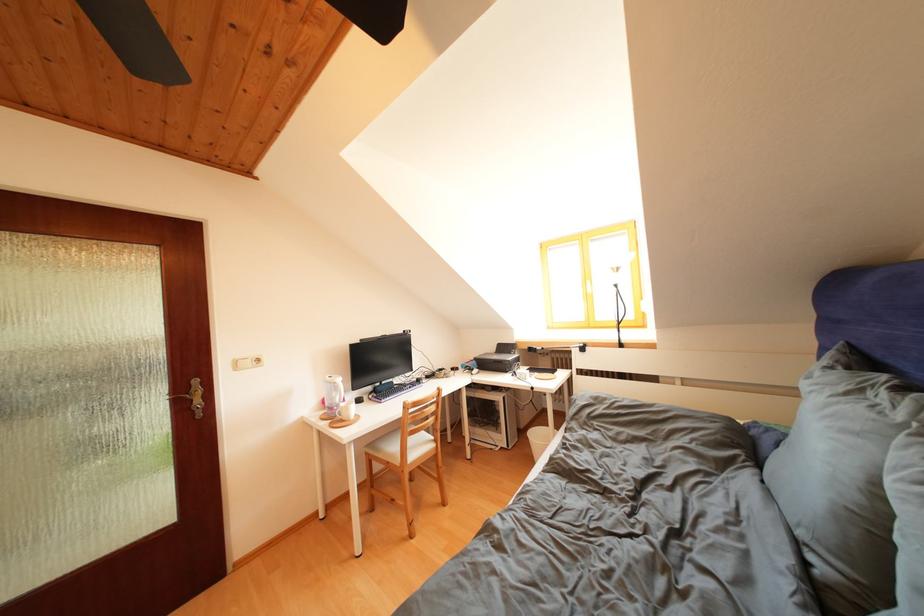
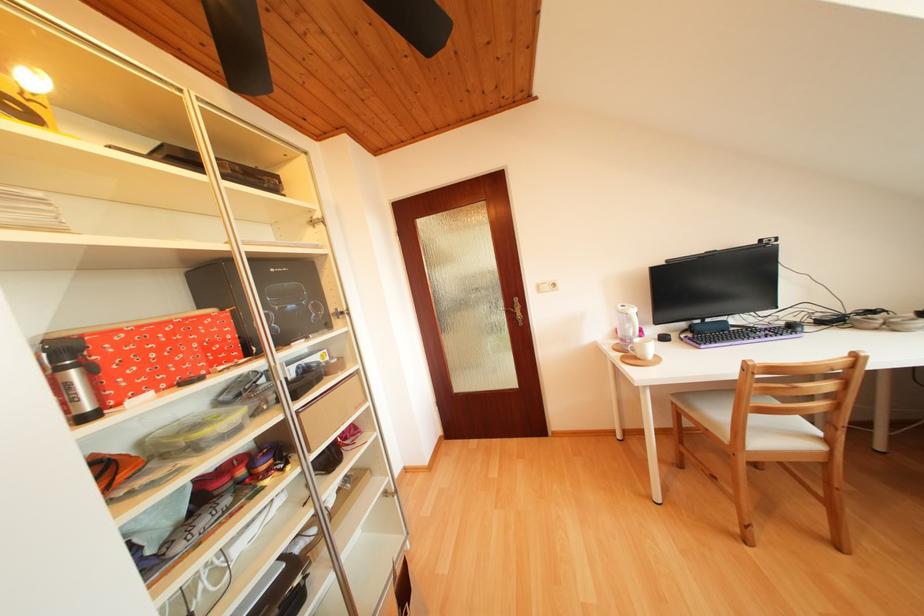
Where in the second image is the point corresponding to [427,386] from the first image?

(799, 331)